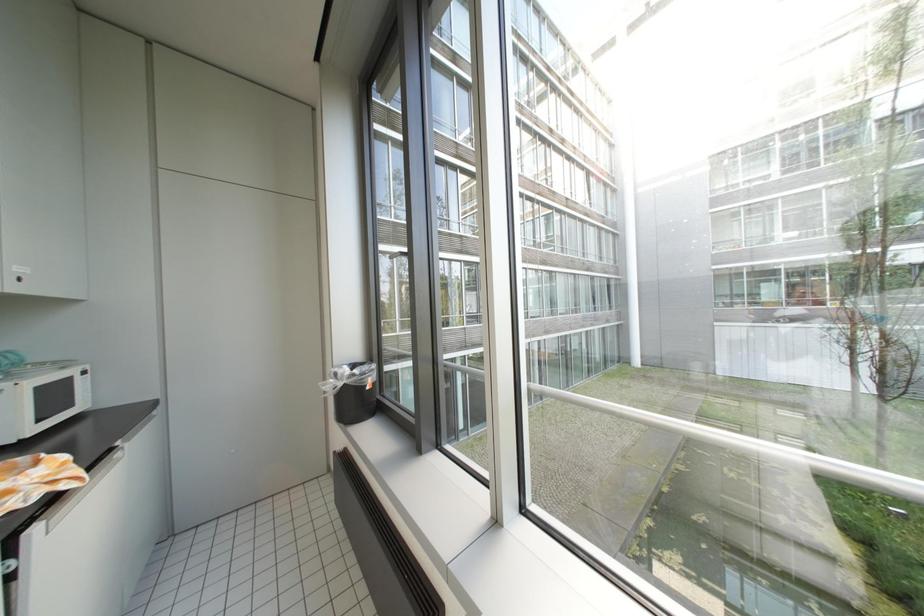
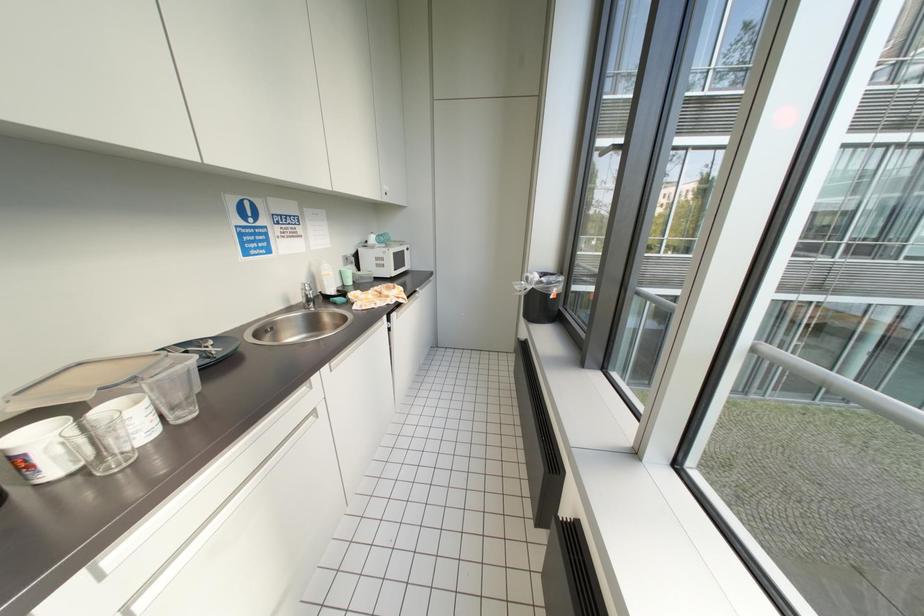
Based on the continuous images, in which direction is the camera rotating?

The camera's rotation is toward left-down.